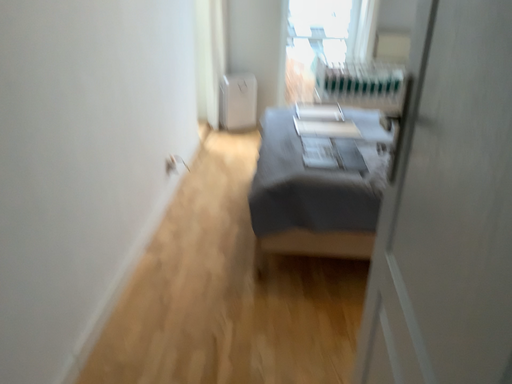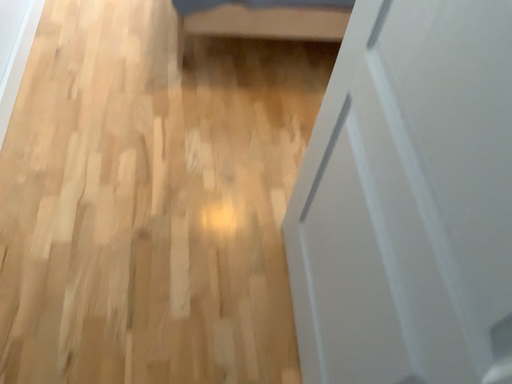
Question: How did the camera likely rotate when shooting the video?

Choices:
 (A) rotated upward
 (B) rotated downward

Answer: (B)